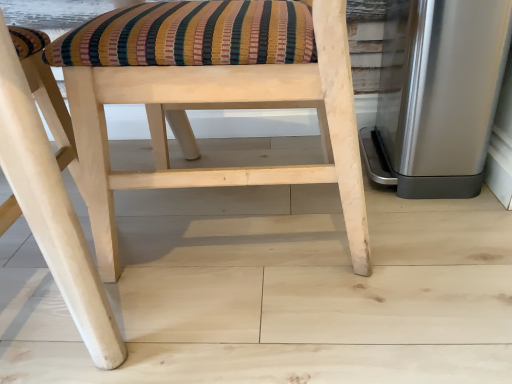
Question: From a real-world perspective, relative to satin silver trash can at right, is natural wood chair at center, which ranks as the second chair in left-to-right order, vertically above or below?

Choices:
 (A) above
 (B) below

Answer: (A)

Question: Considering the positions of natural wood chair at center, which ranks as the second chair in left-to-right order, and satin silver trash can at right in the image, is natural wood chair at center, which ranks as the second chair in left-to-right order, bigger or smaller than satin silver trash can at right?

Choices:
 (A) big
 (B) small

Answer: (A)

Question: Estimate the real-world distances between objects in this image. Which object is closer to the natural wood chair at center, which appears as the 1th chair when viewed from the right?

Choices:
 (A) satin silver trash can at right
 (B) natural wood chair at center, which appears as the 1th chair when viewed from the left

Answer: (B)

Question: Estimate the real-world distances between objects in this image. Which object is farther from the natural wood chair at center, which appears as the 1th chair when viewed from the right?

Choices:
 (A) satin silver trash can at right
 (B) natural wood chair at center, the 2th chair from the right

Answer: (A)